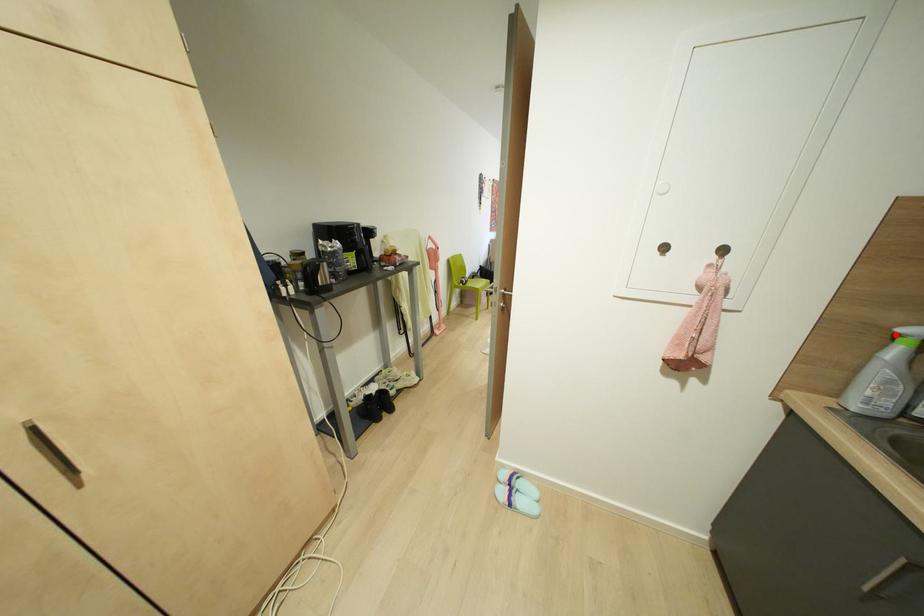
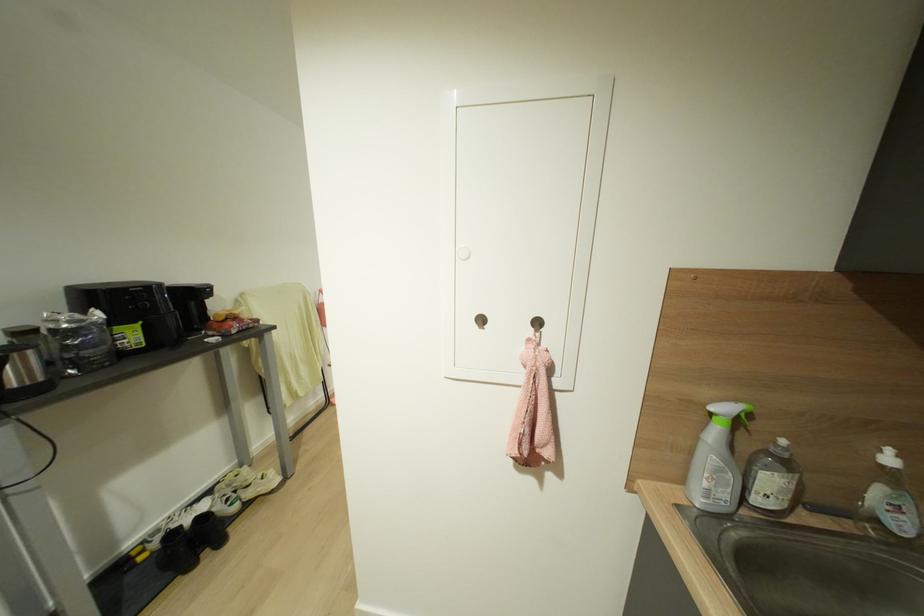
Locate, in the second image, the point that corresponds to the highlighted location in the first image.

(711, 411)